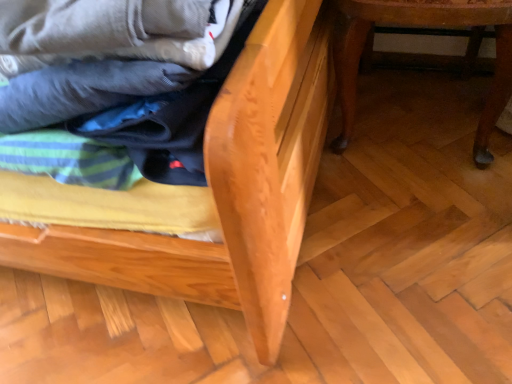
Image resolution: width=512 pixels, height=384 pixels. What do you see at coordinates (213, 190) in the screenshot?
I see `natural wood bed frame at center, positioned as the 1th furniture in left-to-right order` at bounding box center [213, 190].

What is the approximate width of matte cotton laundry at center?

Answer: matte cotton laundry at center is 16.80 inches wide.

The width and height of the screenshot is (512, 384). Identify the location of wooden table at lower right, which ranks as the second furniture in left-to-right order. (428, 25).

Find the location of a particular element. The height and width of the screenshot is (384, 512). natural wood bed frame at center, which is the 2th furniture in right-to-left order is located at coordinates (213, 190).

Is wooden table at lower right, arranged as the 1th furniture when viewed from the right, inside the boundaries of matte cotton laundry at center, or outside?

wooden table at lower right, arranged as the 1th furniture when viewed from the right, is not inside matte cotton laundry at center, it's outside.

From the image's perspective, is wooden table at lower right, arranged as the 1th furniture when viewed from the right, under matte cotton laundry at center?

No, from the image's perspective, wooden table at lower right, arranged as the 1th furniture when viewed from the right, is not beneath matte cotton laundry at center.

From the image's perspective, starting from the matte cotton laundry at center, which furniture is the 2nd one above? Please provide its 2D coordinates.

[(428, 25)]

Measure the distance from wooden table at lower right, which ranks as the second furniture in left-to-right order, to matte cotton laundry at center.

50.03 centimeters.

From a real-world perspective, is matte cotton laundry at center on wooden table at lower right, which ranks as the second furniture in left-to-right order?

Correct, in the physical world, matte cotton laundry at center is higher than wooden table at lower right, which ranks as the second furniture in left-to-right order.

Considering the relative sizes of matte cotton laundry at center and wooden table at lower right, which ranks as the second furniture in left-to-right order, in the image provided, is matte cotton laundry at center taller than wooden table at lower right, which ranks as the second furniture in left-to-right order,?

No.

Considering the relative positions of matte cotton laundry at center and wooden table at lower right, arranged as the 1th furniture when viewed from the right, in the image provided, is matte cotton laundry at center to the left of wooden table at lower right, arranged as the 1th furniture when viewed from the right, from the viewer's perspective?

Yes.

Between matte cotton laundry at center and wooden table at lower right, which ranks as the second furniture in left-to-right order, which one has smaller size?

With smaller size is matte cotton laundry at center.

Locate an element on the screen. This screenshot has height=384, width=512. furniture that is the 1st object directly below the matte cotton laundry at center (from a real-world perspective) is located at coordinates (213, 190).

From a real-world perspective, between natural wood bed frame at center, positioned as the 1th furniture in left-to-right order, and matte cotton laundry at center, who is vertically lower?

From a 3D spatial view, natural wood bed frame at center, positioned as the 1th furniture in left-to-right order, is below.

From the image's perspective, which is above, natural wood bed frame at center, positioned as the 1th furniture in left-to-right order, or matte cotton laundry at center?

natural wood bed frame at center, positioned as the 1th furniture in left-to-right order.

Is point (47, 233) closer to viewer compared to point (166, 148)?

No.

Is matte cotton laundry at center taller than natural wood bed frame at center, positioned as the 1th furniture in left-to-right order?

In fact, matte cotton laundry at center may be shorter than natural wood bed frame at center, positioned as the 1th furniture in left-to-right order.

Can you tell me how much matte cotton laundry at center and natural wood bed frame at center, which is the 2th furniture in right-to-left order, differ in facing direction?

There is a 0.571-degree angle between the facing directions of matte cotton laundry at center and natural wood bed frame at center, which is the 2th furniture in right-to-left order.

Could you tell me if matte cotton laundry at center is facing natural wood bed frame at center, which is the 2th furniture in right-to-left order?

Yes, matte cotton laundry at center faces towards natural wood bed frame at center, which is the 2th furniture in right-to-left order.

Is matte cotton laundry at center wider or thinner than natural wood bed frame at center, which is the 2th furniture in right-to-left order?

matte cotton laundry at center is thinner than natural wood bed frame at center, which is the 2th furniture in right-to-left order.

Looking at the image, does wooden table at lower right, arranged as the 1th furniture when viewed from the right, seem bigger or smaller compared to natural wood bed frame at center, which is the 2th furniture in right-to-left order?

wooden table at lower right, arranged as the 1th furniture when viewed from the right, is smaller than natural wood bed frame at center, which is the 2th furniture in right-to-left order.

Can you see wooden table at lower right, which ranks as the second furniture in left-to-right order, touching natural wood bed frame at center, positioned as the 1th furniture in left-to-right order?

There is a gap between wooden table at lower right, which ranks as the second furniture in left-to-right order, and natural wood bed frame at center, positioned as the 1th furniture in left-to-right order.

Is wooden table at lower right, arranged as the 1th furniture when viewed from the right, positioned behind natural wood bed frame at center, positioned as the 1th furniture in left-to-right order?

Yes, it is.

Can you confirm if natural wood bed frame at center, which is the 2th furniture in right-to-left order, is taller than wooden table at lower right, which ranks as the second furniture in left-to-right order?

Indeed, natural wood bed frame at center, which is the 2th furniture in right-to-left order, has a greater height compared to wooden table at lower right, which ranks as the second furniture in left-to-right order.

Would you say wooden table at lower right, which ranks as the second furniture in left-to-right order, is part of natural wood bed frame at center, which is the 2th furniture in right-to-left order,'s contents?

No, wooden table at lower right, which ranks as the second furniture in left-to-right order, is not surrounded by natural wood bed frame at center, which is the 2th furniture in right-to-left order.

In the scene shown: Who is smaller, natural wood bed frame at center, positioned as the 1th furniture in left-to-right order, or wooden table at lower right, which ranks as the second furniture in left-to-right order?

wooden table at lower right, which ranks as the second furniture in left-to-right order.

Identify the location of laundry above the wooden table at lower right, arranged as the 1th furniture when viewed from the right (from a real-world perspective). Image resolution: width=512 pixels, height=384 pixels. (116, 116).

The height and width of the screenshot is (384, 512). Find the location of `the 2nd furniture above when counting from the matte cotton laundry at center (from the image's perspective)`. the 2nd furniture above when counting from the matte cotton laundry at center (from the image's perspective) is located at coordinates (428, 25).

Looking at the image, which one is located further to wooden table at lower right, which ranks as the second furniture in left-to-right order, matte cotton laundry at center or natural wood bed frame at center, which is the 2th furniture in right-to-left order?

matte cotton laundry at center is positioned further to the anchor wooden table at lower right, which ranks as the second furniture in left-to-right order.

Looking at the image, which one is located further to natural wood bed frame at center, which is the 2th furniture in right-to-left order, wooden table at lower right, which ranks as the second furniture in left-to-right order, or matte cotton laundry at center?

Among the two, wooden table at lower right, which ranks as the second furniture in left-to-right order, is located further to natural wood bed frame at center, which is the 2th furniture in right-to-left order.

When comparing their distances from wooden table at lower right, which ranks as the second furniture in left-to-right order, does natural wood bed frame at center, which is the 2th furniture in right-to-left order, or matte cotton laundry at center seem further?

Based on the image, matte cotton laundry at center appears to be further to wooden table at lower right, which ranks as the second furniture in left-to-right order.

Estimate the real-world distances between objects in this image. Which object is closer to natural wood bed frame at center, positioned as the 1th furniture in left-to-right order, matte cotton laundry at center or wooden table at lower right, which ranks as the second furniture in left-to-right order?

matte cotton laundry at center is closer to natural wood bed frame at center, positioned as the 1th furniture in left-to-right order.

Considering their positions, is wooden table at lower right, which ranks as the second furniture in left-to-right order, positioned closer to matte cotton laundry at center than natural wood bed frame at center, which is the 2th furniture in right-to-left order?

natural wood bed frame at center, which is the 2th furniture in right-to-left order, lies closer to matte cotton laundry at center than the other object.

Which object lies further to the anchor point matte cotton laundry at center, natural wood bed frame at center, positioned as the 1th furniture in left-to-right order, or wooden table at lower right, arranged as the 1th furniture when viewed from the right?

wooden table at lower right, arranged as the 1th furniture when viewed from the right, lies further to matte cotton laundry at center than the other object.

Where is `laundry between natural wood bed frame at center, which is the 2th furniture in right-to-left order, and wooden table at lower right, which ranks as the second furniture in left-to-right order`? laundry between natural wood bed frame at center, which is the 2th furniture in right-to-left order, and wooden table at lower right, which ranks as the second furniture in left-to-right order is located at coordinates (116, 116).